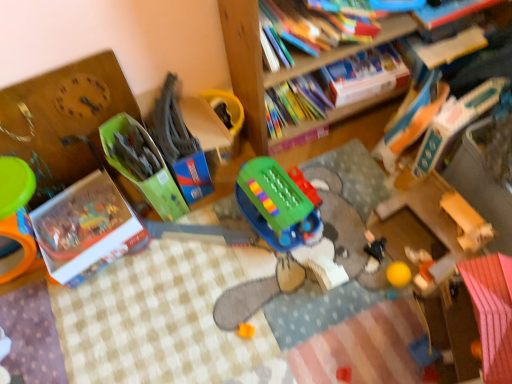
At what (x,y) coordinates should I click in order to perform the action: click on vacant space behind black plastic toy at center, positioned as the fifth toy in left-to-right order. Please return your answer as a coordinate pair (x, y). This screenshot has width=512, height=384. Looking at the image, I should click on (371, 209).